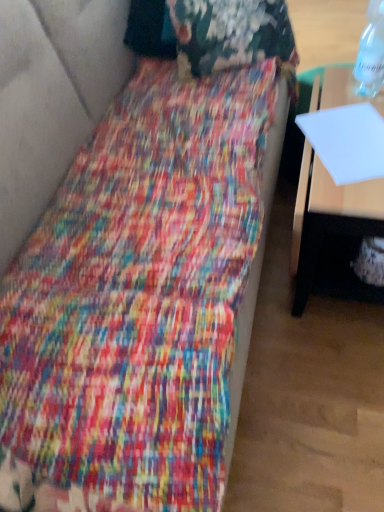
The width and height of the screenshot is (384, 512). What are the coordinates of `free space above light brown wooden table at right (from a real-world perspective)` in the screenshot? It's located at (349, 132).